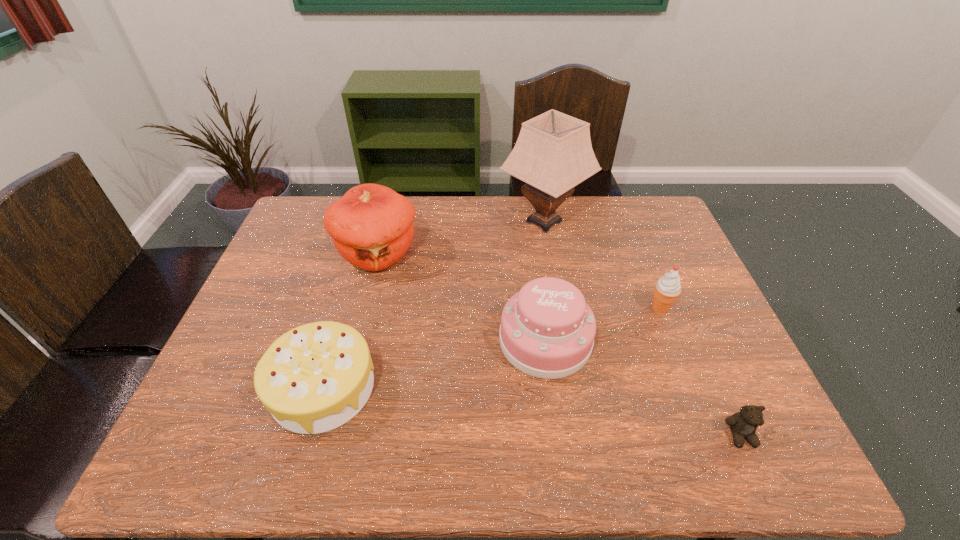
I want to click on free space located 0.340m on the right of the left birthday cake, so click(517, 387).

I want to click on lampshade located in the far edge section of the desktop, so click(553, 153).

Find the location of a particular element. Image resolution: width=960 pixels, height=540 pixels. pumpkin at the far edge is located at coordinates (371, 226).

Where is `birthday cake that is at the near edge`? birthday cake that is at the near edge is located at coordinates (314, 378).

Identify the location of teddy bear situated at the near edge. (743, 424).

I want to click on object at the left edge, so tap(314, 378).

The width and height of the screenshot is (960, 540). In order to click on icecream that is at the right edge in this screenshot , I will do `click(667, 289)`.

The height and width of the screenshot is (540, 960). What are the coordinates of `teddy bear that is at the right edge` in the screenshot? It's located at (743, 424).

You are a GUI agent. You are given a task and a screenshot of the screen. Output one action in this format:
    pyautogui.click(x=<x>, y=<y>)
    Task: Click on the object present at the near left corner
    The width and height of the screenshot is (960, 540).
    Given the screenshot: What is the action you would take?
    pyautogui.click(x=314, y=378)

Identify the location of object present at the near right corner. (743, 424).